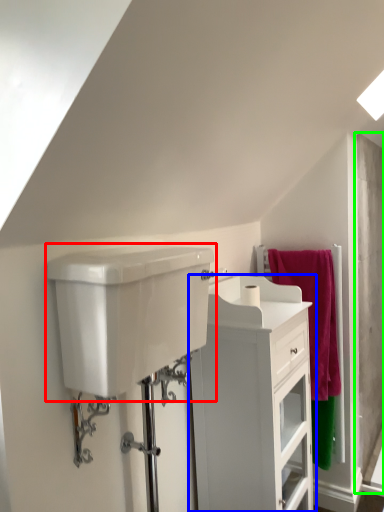
Question: Considering the real-world distances, which object is farthest from sink (highlighted by a red box)? bathroom cabinet (highlighted by a blue box) or screen door (highlighted by a green box)?

Choices:
 (A) bathroom cabinet
 (B) screen door

Answer: (B)